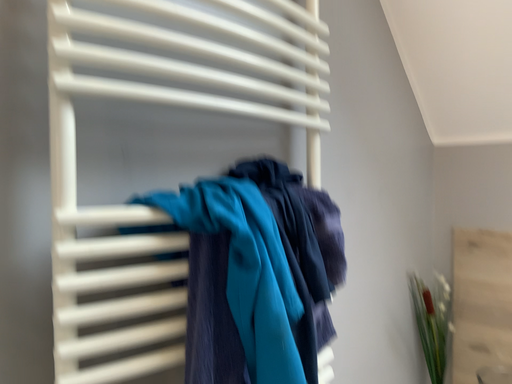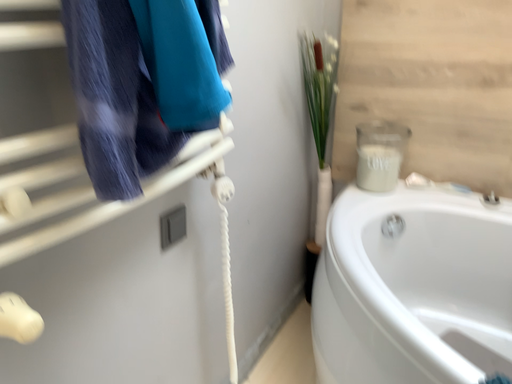
Question: Which way did the camera rotate in the video?

Choices:
 (A) rotated left
 (B) rotated right

Answer: (B)